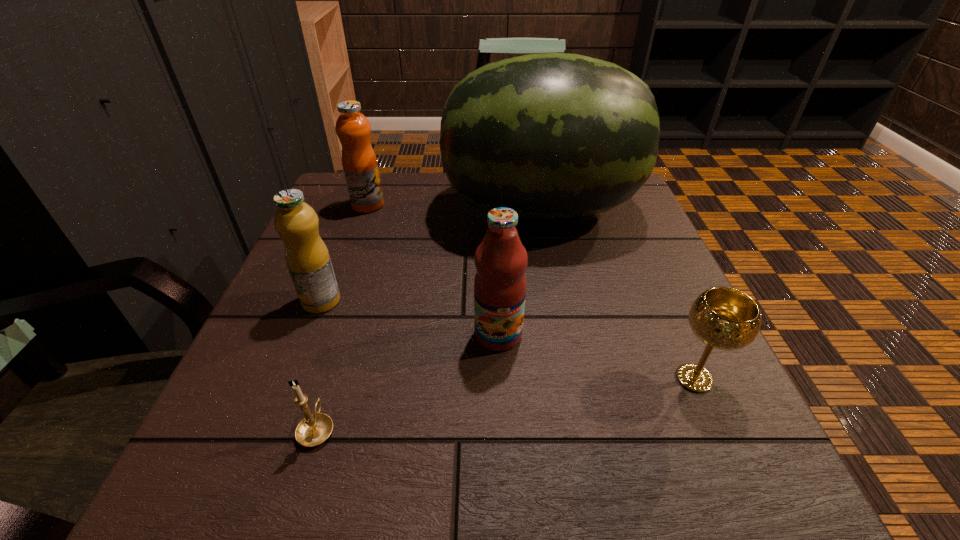
Find the location of `vacant space in between the second nearest fruit juice and the tallest object`. vacant space in between the second nearest fruit juice and the tallest object is located at coordinates (430, 254).

Choose which object is the second nearest neighbor to the farthest fruit juice. Please provide its 2D coordinates. Your answer should be formatted as a tuple, i.e. [(x, y)], where the tuple contains the x and y coordinates of a point satisfying the conditions above.

[(307, 258)]

Identify the location of object that can be found as the fourth closest to the third farthest object. The width and height of the screenshot is (960, 540). (353, 129).

At what (x,y) coordinates should I click in order to perform the action: click on the closest fruit juice relative to the nearest object. Please return your answer as a coordinate pair (x, y). This screenshot has width=960, height=540. Looking at the image, I should click on (307, 258).

Point out which fruit juice is positioned as the third nearest to the chalice. Please provide its 2D coordinates. Your answer should be formatted as a tuple, i.e. [(x, y)], where the tuple contains the x and y coordinates of a point satisfying the conditions above.

[(353, 129)]

Find the location of `free space that satisfies the following two spatial constraints: 1. on the front label of the second nearest object; 2. on the right side of the fourth nearest object`. free space that satisfies the following two spatial constraints: 1. on the front label of the second nearest object; 2. on the right side of the fourth nearest object is located at coordinates (291, 379).

Locate an element on the screen. This screenshot has height=540, width=960. vacant space that satisfies the following two spatial constraints: 1. on the front label of the second shortest object; 2. on the left side of the rightmost fruit juice is located at coordinates (500, 379).